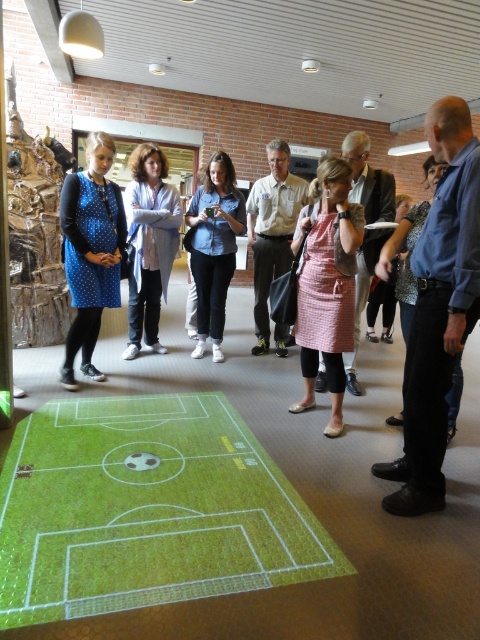
You are standing at the center of the room and want to take a photo of the blue shirt at right. Which direction should you move to get a better angle?

The blue shirt at right is located at point 0.484 on the x axis and 0.915 on the y axis. To get a better angle, you should move to the left side of the room to capture the subject more clearly.

You are a photographer at the event and need to capture a photo of both the pink checkered apron at center and the blue denim shirt at center in the same frame. Given that your camera has a minimum focus distance of 1 meter, will you be able to take the photo without moving either subject?

The pink checkered apron at center and blue denim shirt at center are 1.08 meters apart from each other. Since the camera requires a minimum focus distance of 1 meter, the subjects are within range. Therefore, you can take the photo without moving them.